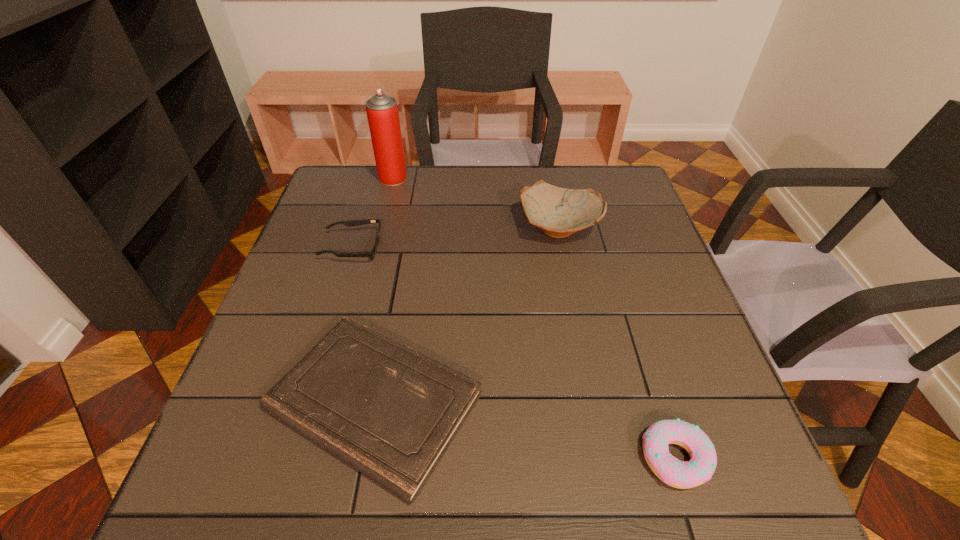
At what (x,y) coordinates should I click in order to perform the action: click on object at the far left corner. Please return your answer as a coordinate pair (x, y). Looking at the image, I should click on (382, 112).

Locate an element on the screen. The image size is (960, 540). object present at the near left corner is located at coordinates (389, 411).

This screenshot has height=540, width=960. I want to click on object situated at the far right corner, so click(559, 212).

Identify the location of object that is at the near right corner. (699, 469).

Locate an element on the screen. The height and width of the screenshot is (540, 960). vacant space at the far edge of the desktop is located at coordinates (391, 207).

Find the location of a particular element. vacant space at the near edge of the desktop is located at coordinates (357, 472).

This screenshot has width=960, height=540. In the image, there is a desktop. Find the location of `free space at the left edge`. free space at the left edge is located at coordinates (335, 313).

Identify the location of free space at the right edge of the desktop. Image resolution: width=960 pixels, height=540 pixels. (655, 271).

Image resolution: width=960 pixels, height=540 pixels. In the image, there is a desktop. What are the coordinates of `vacant space at the near left corner` in the screenshot? It's located at (245, 496).

In order to click on blank region between the sunglasses and the doughnut in this screenshot , I will do `click(515, 353)`.